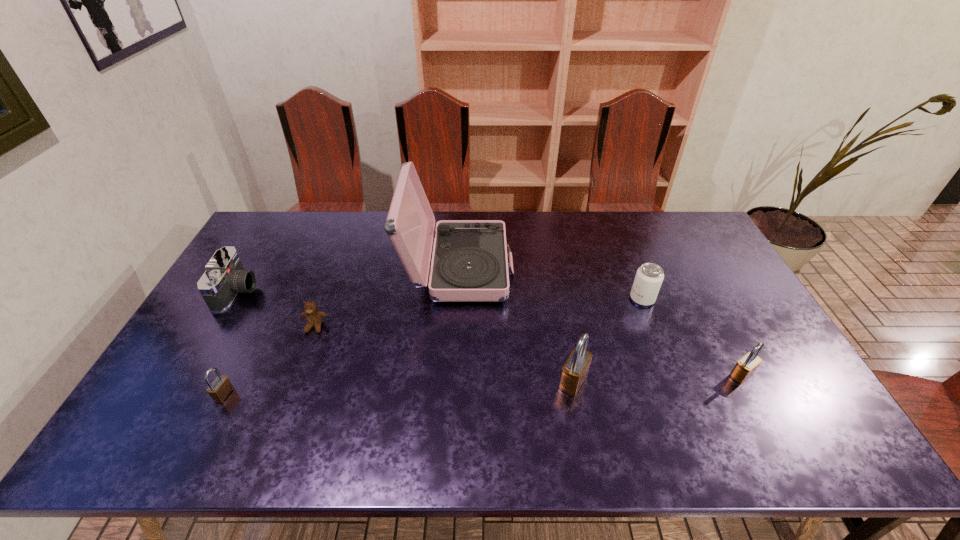
You are a GUI agent. You are given a task and a screenshot of the screen. Output one action in this format:
    pyautogui.click(x=<x>, y=<y>)
    Task: Click on the vacant space that satisfies the following two spatial constraints: 1. on the front-facing side of the leftmost object; 2. on the back side of the sixth object from right to left
    This screenshot has width=960, height=540.
    Given the screenshot: What is the action you would take?
    pyautogui.click(x=177, y=395)